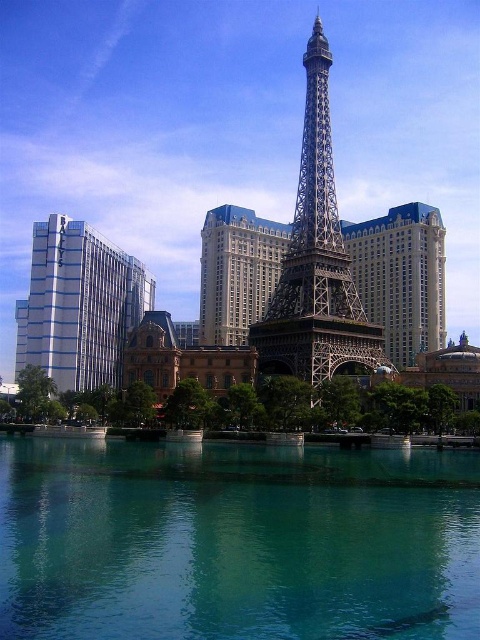
Question: Can you confirm if teal glassy water at center is thinner than metallic silver eiffel tower at center?

Choices:
 (A) no
 (B) yes

Answer: (A)

Question: Which of these objects is positioned closest to the metallic silver eiffel tower at center?

Choices:
 (A) teal glassy water at center
 (B) metallic structure at center
 (C) white glossy building at left

Answer: (B)

Question: Which point appears farthest from the camera in this image?

Choices:
 (A) (76, 228)
 (B) (312, 218)
 (C) (356, 486)
 (D) (266, 260)

Answer: (D)

Question: In this image, where is teal glassy water at center located relative to metallic silver eiffel tower at center?

Choices:
 (A) right
 (B) left

Answer: (B)

Question: Which point appears farthest from the camera in this image?

Choices:
 (A) (356, 528)
 (B) (315, 387)

Answer: (B)

Question: Does metallic silver eiffel tower at center appear over metallic structure at center?

Choices:
 (A) no
 (B) yes

Answer: (A)